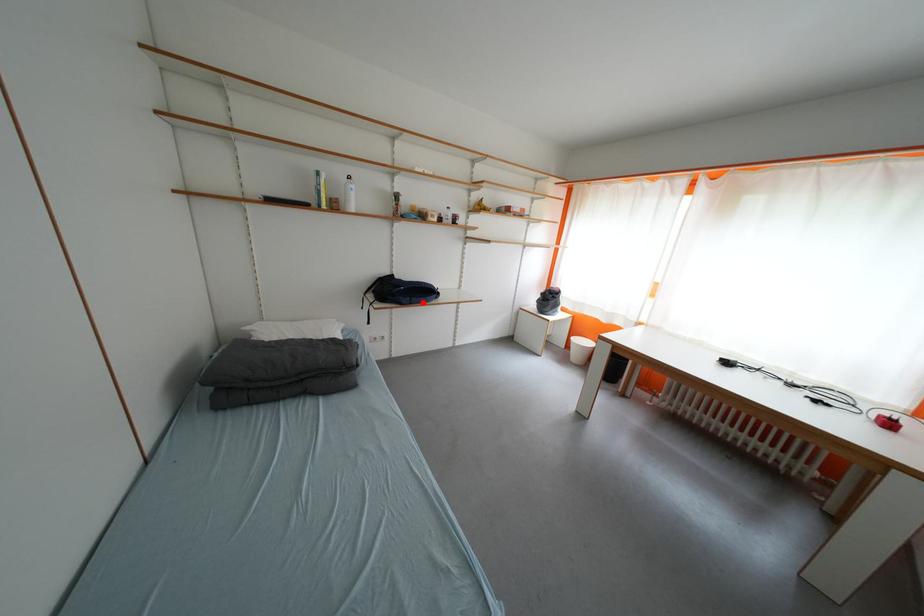
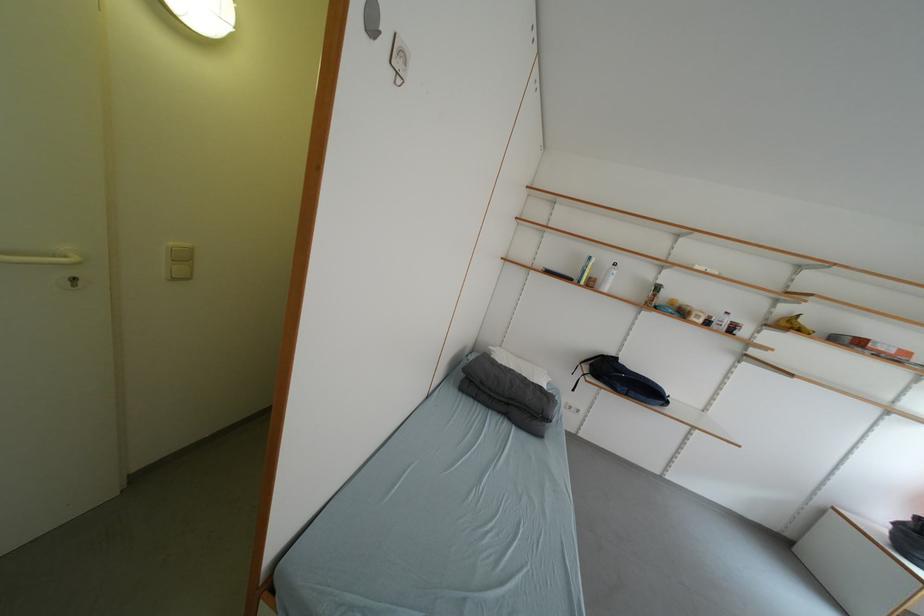
The point at the highlighted location is marked in the first image. Where is the corresponding point in the second image?

(640, 395)